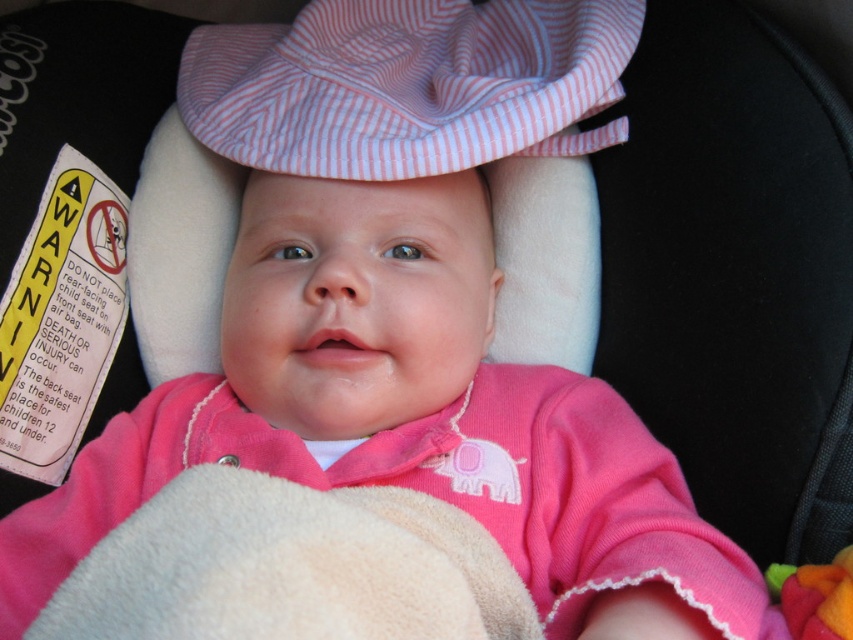
Where is `pink striped fabric hat at upper center`? The height and width of the screenshot is (640, 853). pink striped fabric hat at upper center is located at coordinates (408, 84).

Can you confirm if pink striped fabric hat at upper center is positioned to the left of fluffy felt toy at lower right?

Yes, pink striped fabric hat at upper center is to the left of fluffy felt toy at lower right.

Which is in front, point (596, 65) or point (805, 602)?

Positioned in front is point (805, 602).

You are a GUI agent. You are given a task and a screenshot of the screen. Output one action in this format:
    pyautogui.click(x=<x>, y=<y>)
    Task: Click on the pink striped fabric hat at upper center
    The width and height of the screenshot is (853, 640).
    Given the screenshot: What is the action you would take?
    pyautogui.click(x=408, y=84)